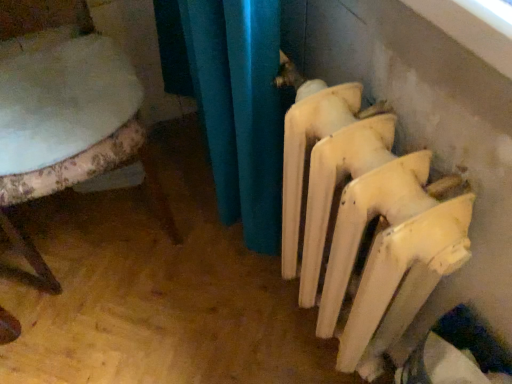
Question: Should I look upward or downward to see white matte radiator at lower right?

Choices:
 (A) up
 (B) down

Answer: (B)

Question: Could white matte radiator at lower right be considered to be inside white fabric chair at left?

Choices:
 (A) no
 (B) yes

Answer: (A)

Question: Is white fabric chair at left beside white matte radiator at lower right?

Choices:
 (A) yes
 (B) no

Answer: (B)

Question: Is white fabric chair at left taller than white matte radiator at lower right?

Choices:
 (A) yes
 (B) no

Answer: (A)

Question: Is white fabric chair at left facing away from white matte radiator at lower right?

Choices:
 (A) yes
 (B) no

Answer: (B)

Question: Is white fabric chair at left to the left of white matte radiator at lower right from the viewer's perspective?

Choices:
 (A) no
 (B) yes

Answer: (B)

Question: Is white fabric chair at left to the right of white matte radiator at lower right from the viewer's perspective?

Choices:
 (A) yes
 (B) no

Answer: (B)

Question: From a real-world perspective, is white matte radiator at lower right positioned under white fabric chair at left based on gravity?

Choices:
 (A) yes
 (B) no

Answer: (B)

Question: From the image's perspective, would you say white matte radiator at lower right is shown under white fabric chair at left?

Choices:
 (A) no
 (B) yes

Answer: (B)

Question: From a real-world perspective, is white matte radiator at lower right on white fabric chair at left?

Choices:
 (A) yes
 (B) no

Answer: (A)

Question: Would you say white matte radiator at lower right is outside white fabric chair at left?

Choices:
 (A) yes
 (B) no

Answer: (A)

Question: Considering the relative sizes of white matte radiator at lower right and white fabric chair at left in the image provided, is white matte radiator at lower right thinner than white fabric chair at left?

Choices:
 (A) no
 (B) yes

Answer: (B)

Question: Is white matte radiator at lower right positioned far away from white fabric chair at left?

Choices:
 (A) yes
 (B) no

Answer: (B)

Question: From their relative heights in the image, would you say white fabric chair at left is taller or shorter than white matte radiator at lower right?

Choices:
 (A) tall
 (B) short

Answer: (A)